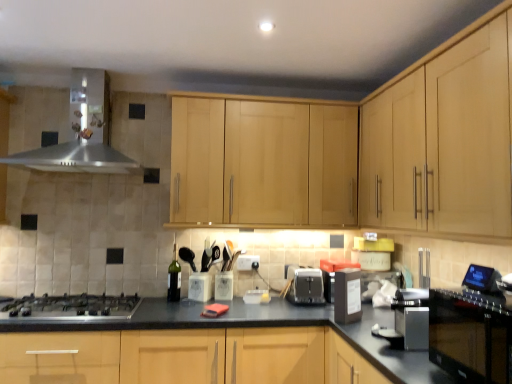
Question: Visually, is light wood cabinet at upper right, the first cabinetry in the right-to-left sequence, positioned to the left or to the right of light wood cabinet at center, marked as the second cabinetry in a right-to-left arrangement?

Choices:
 (A) left
 (B) right

Answer: (B)

Question: From the image's perspective, is light wood cabinet at upper right, the first cabinetry in the right-to-left sequence, above or below light wood cabinet at center, marked as the second cabinetry in a right-to-left arrangement?

Choices:
 (A) above
 (B) below

Answer: (A)

Question: Which object is positioned farthest from the satin silver toaster at center, which is the 1th appliance in left-to-right order?

Choices:
 (A) stainless steel range hood at upper left
 (B) black plastic container at center-right, acting as the first appliance starting from the right
 (C) green glass bottle at center
 (D) light wood cabinet at upper right, which ranks as the second cabinetry in left-to-right order
 (E) light wood cabinet at center, marked as the second cabinetry in a right-to-left arrangement

Answer: (A)

Question: Which object is the farthest from the black glossy oven at lower right?

Choices:
 (A) black granite countertop at center
 (B) black plastic container at center-right, acting as the first appliance starting from the right
 (C) light wood cabinet at upper right, the first cabinetry in the right-to-left sequence
 (D) green glass bottle at center
 (E) satin silver gas stove at lower left

Answer: (D)